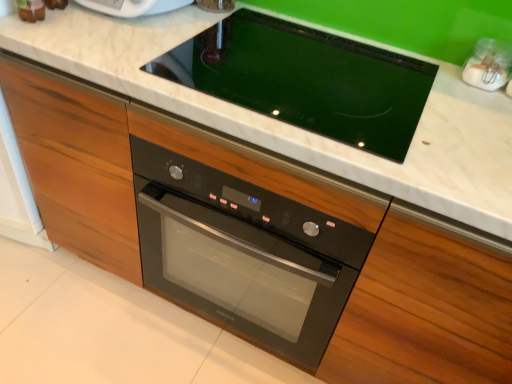
Question: Does black glass cooktop at center lie behind white marble countertop at center?

Choices:
 (A) no
 (B) yes

Answer: (B)

Question: Does black glass cooktop at center have a larger size compared to white marble countertop at center?

Choices:
 (A) no
 (B) yes

Answer: (A)

Question: Considering the relative sizes of black glass cooktop at center and white marble countertop at center in the image provided, is black glass cooktop at center taller than white marble countertop at center?

Choices:
 (A) yes
 (B) no

Answer: (B)

Question: Is black glass cooktop at center oriented away from white marble countertop at center?

Choices:
 (A) no
 (B) yes

Answer: (B)

Question: Can you confirm if black glass cooktop at center is smaller than white marble countertop at center?

Choices:
 (A) yes
 (B) no

Answer: (A)

Question: Looking at the image, does black glass cooktop at center seem bigger or smaller compared to black glass oven at center?

Choices:
 (A) small
 (B) big

Answer: (A)

Question: From the image's perspective, relative to black glass oven at center, is black glass cooktop at center above or below?

Choices:
 (A) above
 (B) below

Answer: (A)

Question: Based on their positions, is black glass cooktop at center located to the left or right of black glass oven at center?

Choices:
 (A) left
 (B) right

Answer: (B)

Question: In terms of width, does black glass cooktop at center look wider or thinner when compared to black glass oven at center?

Choices:
 (A) thin
 (B) wide

Answer: (A)

Question: Is black glass oven at center taller or shorter than white marble countertop at center?

Choices:
 (A) tall
 (B) short

Answer: (B)

Question: Is black glass oven at center inside the boundaries of white marble countertop at center, or outside?

Choices:
 (A) outside
 (B) inside

Answer: (B)

Question: Relative to white marble countertop at center, is black glass oven at center in front or behind?

Choices:
 (A) front
 (B) behind

Answer: (B)

Question: Based on their sizes in the image, would you say black glass oven at center is bigger or smaller than white marble countertop at center?

Choices:
 (A) small
 (B) big

Answer: (A)

Question: From the image's perspective, relative to black glass cooktop at center, is black glass oven at center above or below?

Choices:
 (A) above
 (B) below

Answer: (B)

Question: From a real-world perspective, is black glass oven at center physically located above or below black glass cooktop at center?

Choices:
 (A) below
 (B) above

Answer: (A)